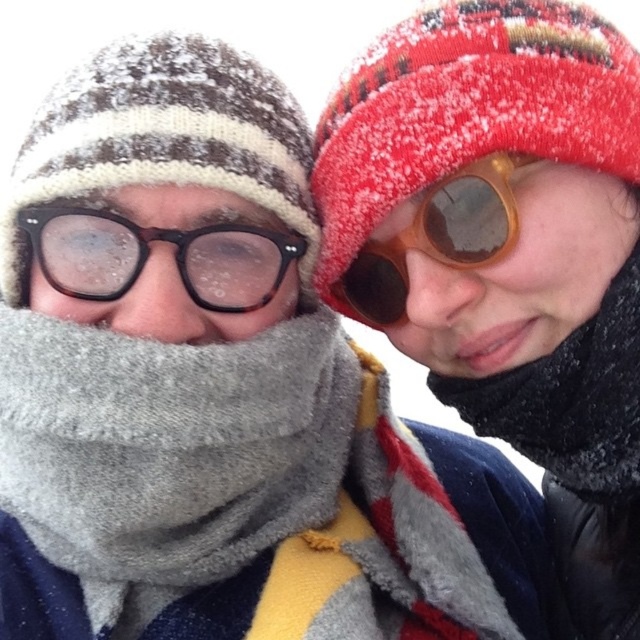
You are standing in a cold environment with two people. You need to take a photo of the point at coordinates point (204,625). The camera you are using has a minimum focus distance of 40 inches. Will the camera be able to focus on the point?

The point (204,625) is 39.06 inches away from the camera, which is less than the minimum focus distance of 40 inches. Therefore, the camera will not be able to focus on the point.

You are standing in a snowy landscape and want to know how far the point at coordinates (x=4, y=417) is from you. Can you determine the distance?

The distance between point (x=4, y=417) and the viewer is 38.36 inches.

You are a photographer setting up a tripod between the tortoiseshell plastic glasses at left and the brown wooden sunglasses at upper right. The tripod requires a minimum distance of 6 inches between its legs to avoid touching either object. Can you safely place the tripod between them?

The tortoiseshell plastic glasses at left is 6.66 inches from brown wooden sunglasses at upper right. Since the required minimum distance is 6 inches, the tripod can be safely placed between them as the distance is sufficient.